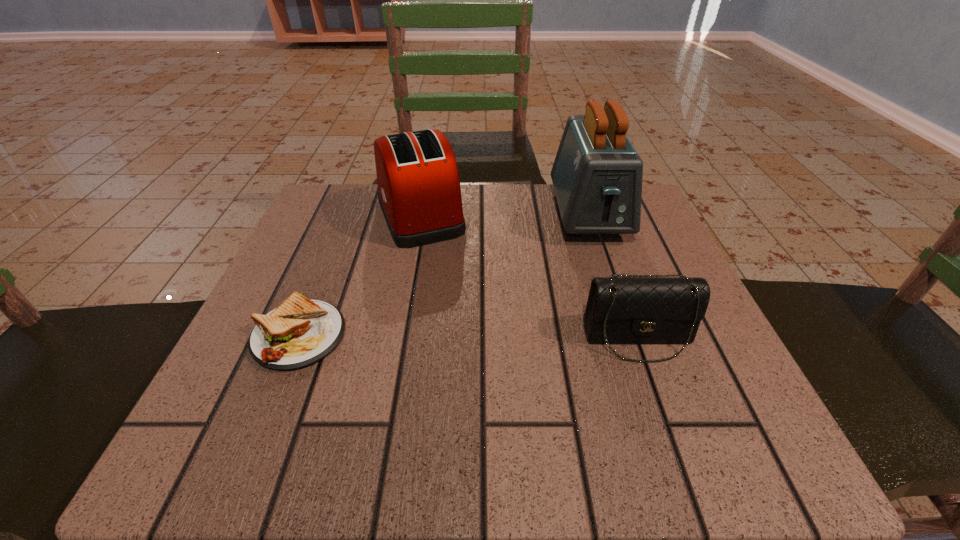
Find the location of a particular element. This screenshot has height=540, width=960. free point between the sandwich and the second shortest object is located at coordinates (468, 337).

Locate which object is the third closest to the sandwich. Please provide its 2D coordinates. Your answer should be formatted as a tuple, i.e. [(x, y)], where the tuple contains the x and y coordinates of a point satisfying the conditions above.

[(597, 174)]

Point out which object is positioned as the nearest to the tallest object. Please provide its 2D coordinates. Your answer should be formatted as a tuple, i.e. [(x, y)], where the tuple contains the x and y coordinates of a point satisfying the conditions above.

[(631, 309)]